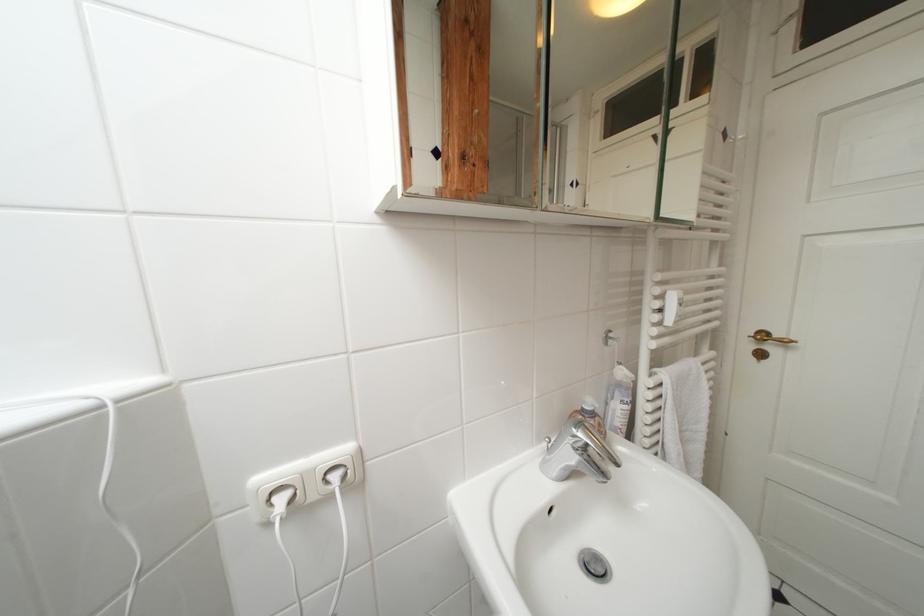
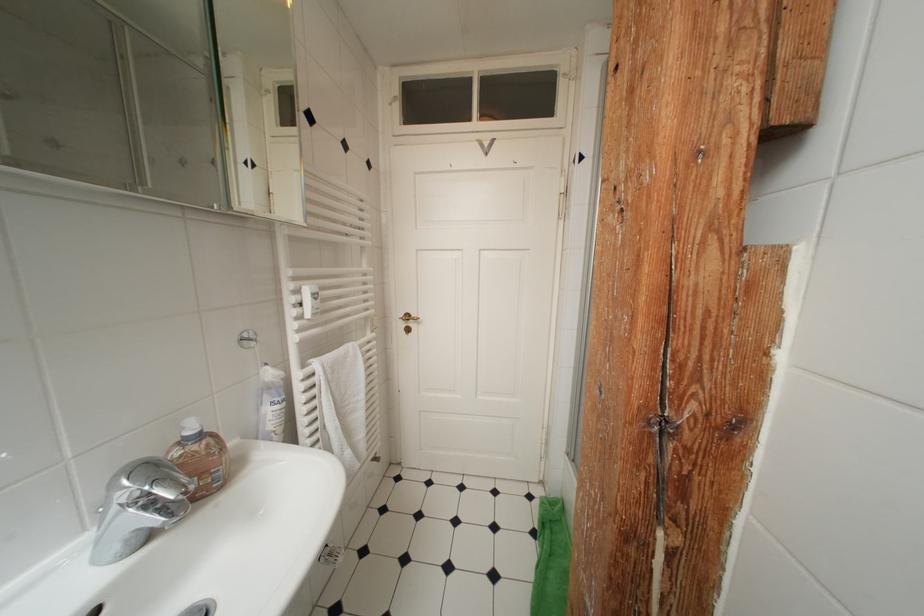
Find the pixel in the second image that matches [670,378] in the first image.

(322, 368)